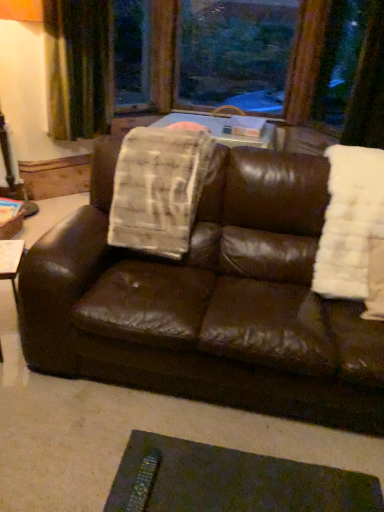
This screenshot has width=384, height=512. I want to click on free space above metallic textured remote at lower center (from a real-world perspective), so click(x=235, y=482).